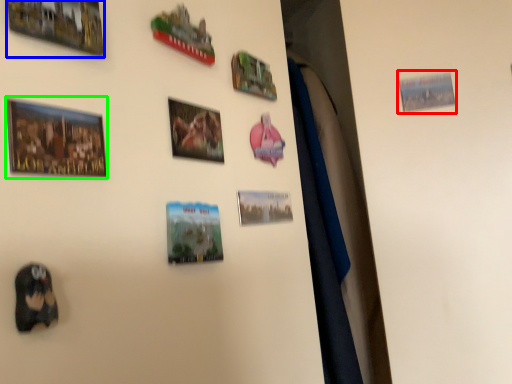
Question: Which is farther away from picture frame (highlighted by a red box)? picture frame (highlighted by a blue box) or picture frame (highlighted by a green box)?

Choices:
 (A) picture frame
 (B) picture frame

Answer: (B)